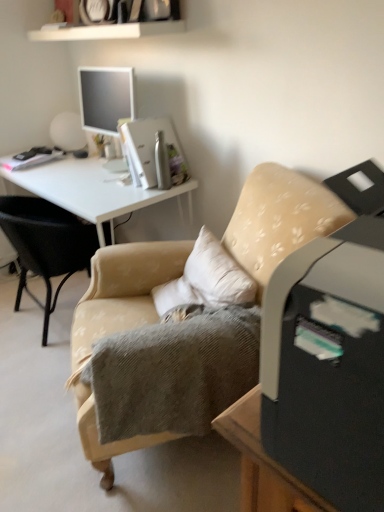
Identify the location of free space above white glossy desk at upper left (from a real-world perspective). (81, 173).